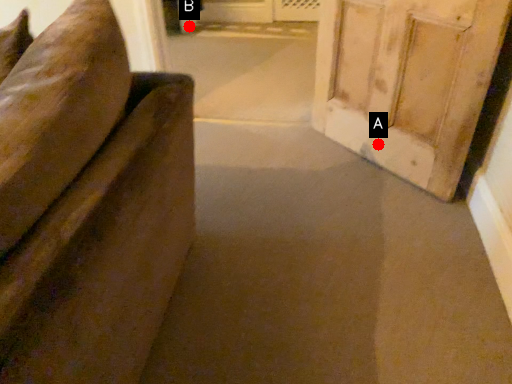
Question: Two points are circled on the image, labeled by A and B beside each circle. Among these points, which one is farthest from the camera?

Choices:
 (A) A is further
 (B) B is further

Answer: (B)